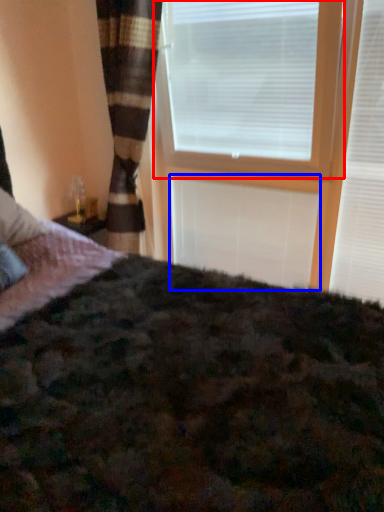
Question: Which object is closer to the camera taking this photo, window blind (highlighted by a red box) or blind (highlighted by a blue box)?

Choices:
 (A) window blind
 (B) blind

Answer: (A)